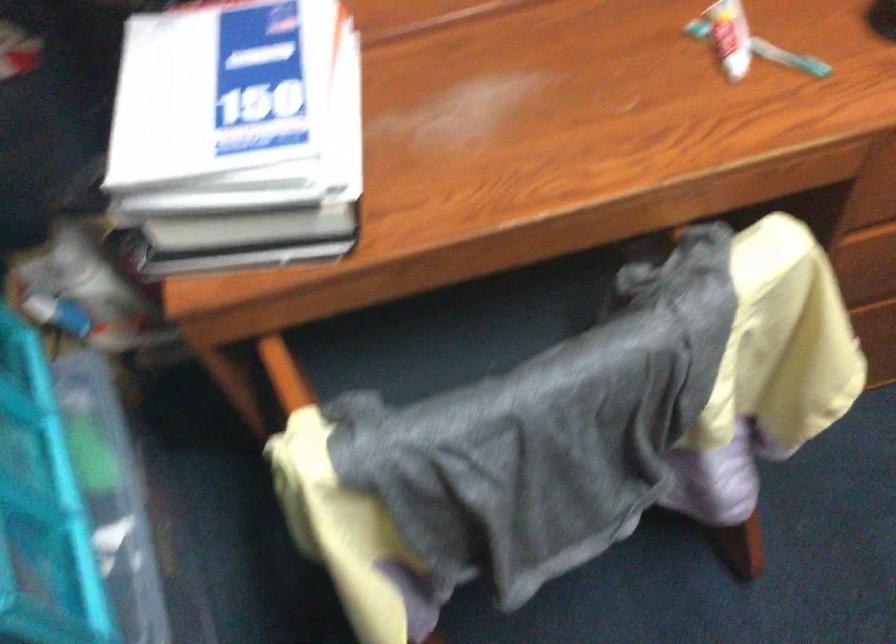
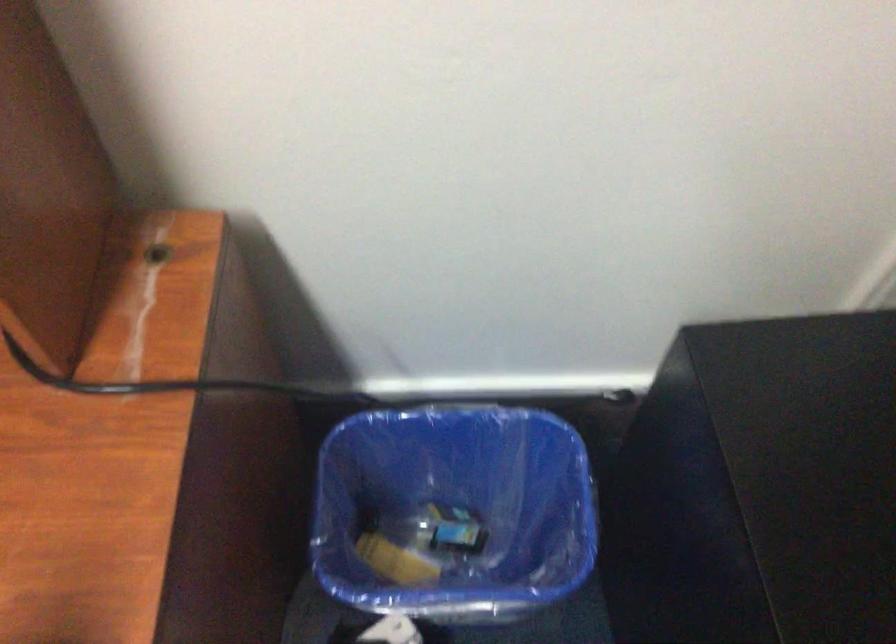
The images are taken continuously from a first-person perspective. In which direction are you moving?

The cameraman moved toward right, forward.